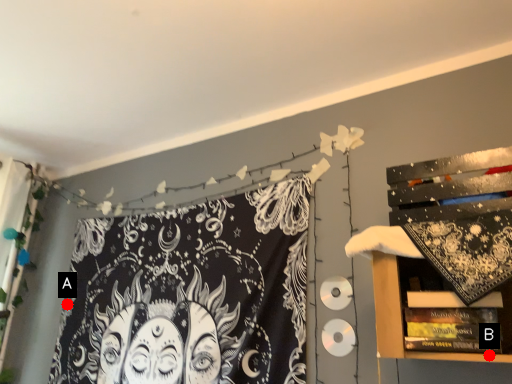
Question: Two points are circled on the image, labeled by A and B beside each circle. Which point appears farthest from the camera in this image?

Choices:
 (A) A is further
 (B) B is further

Answer: (A)